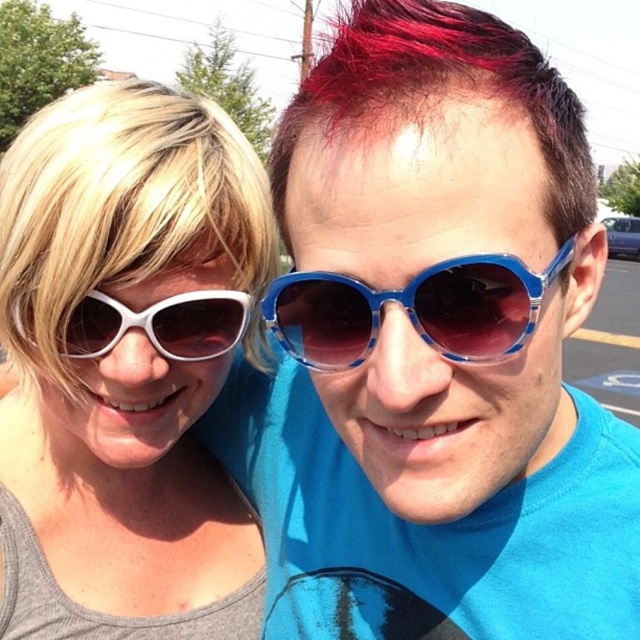
You are a photographer adjusting your camera settings to capture the scene. You notice the shiny red hair at upper center and the white plastic sunglasses at left. Which object should you focus on first if you want to ensure both are in sharp focus, considering their positions?

The shiny red hair at upper center is taller than the white plastic sunglasses at left, so focusing on the shiny red hair at upper center first will help ensure both are in sharp focus since it is farther away.

You are a photographer trying to capture a closeup of the white plastic sunglasses at upper left. Based on the coordinates provided, where should you position your camera to ensure the sunglasses are centered in the frame?

The white plastic sunglasses at upper left are located at point (125, 365), so position your camera so the center of the frame aligns with these coordinates to capture them.

You are a photographer trying to capture a clear shot of the shiny red hair at upper center and the white plastic sunglasses at left. Since the subjects are close together, you need to adjust your focus. Which object is located higher in the frame?

The shiny red hair at upper center is positioned over the white plastic sunglasses at left, so it is higher in the frame.